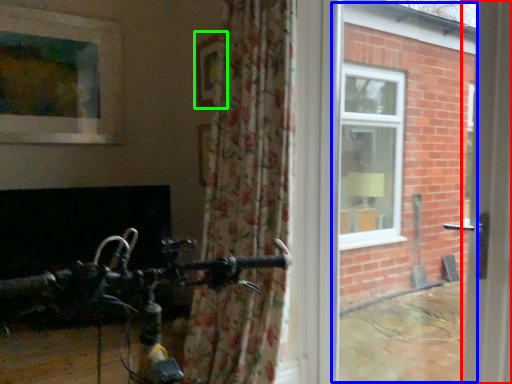
Question: Considering the real-world distances, which object is closest to screen door (highlighted by a red box)? window frame (highlighted by a blue box) or picture frame (highlighted by a green box).

Choices:
 (A) window frame
 (B) picture frame

Answer: (B)